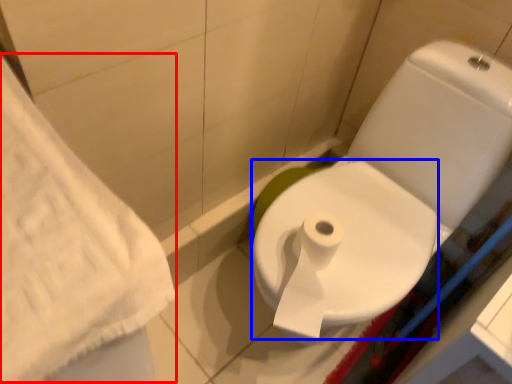
Question: Among these objects, which one is farthest to the camera, bath towel (highlighted by a red box) or bidet (highlighted by a blue box)?

Choices:
 (A) bath towel
 (B) bidet

Answer: (B)